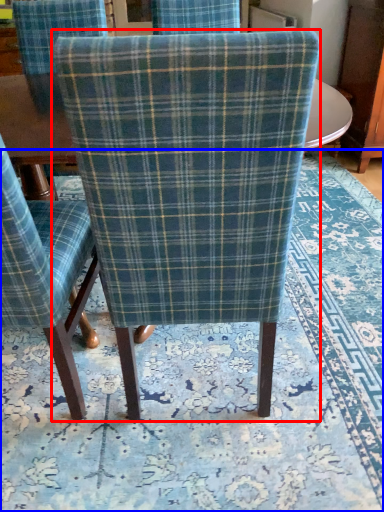
Question: Among these objects, which one is nearest to the camera, chair (highlighted by a red box) or mat (highlighted by a blue box)?

Choices:
 (A) chair
 (B) mat

Answer: (A)